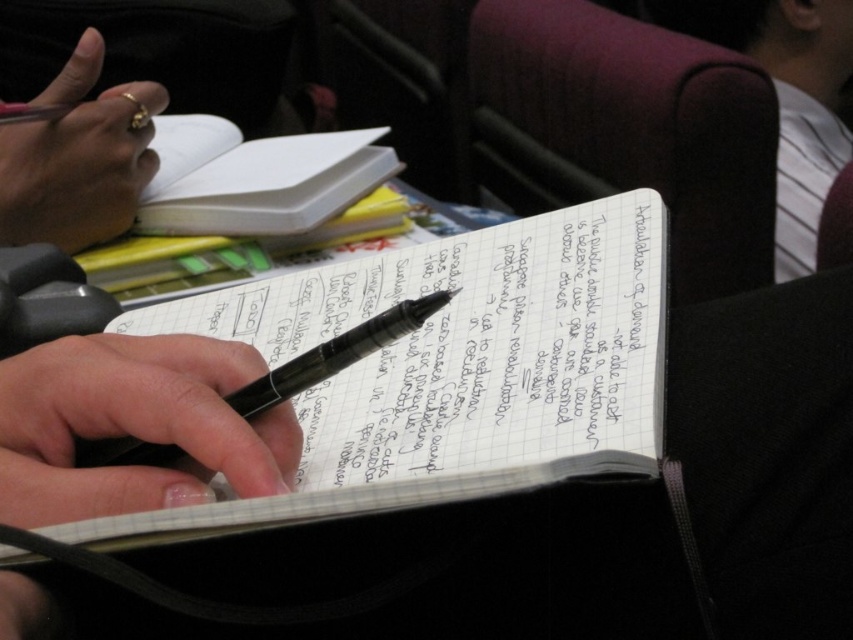
Question: Which of the following is the farthest from the observer?

Choices:
 (A) black matte pen at center
 (B) white lined notebook at center
 (C) white paper notebook at upper center

Answer: (C)

Question: Which point is farther to the camera?

Choices:
 (A) white lined notebook at center
 (B) black matte pen at center

Answer: (B)

Question: Is gold ring at upper left positioned before black glossy pen at center?

Choices:
 (A) yes
 (B) no

Answer: (B)

Question: Which of the following is the farthest from the observer?

Choices:
 (A) gold ring at upper left
 (B) black glossy pen at center

Answer: (A)

Question: Is white lined notebook at center closer to the viewer compared to gold ring at upper left?

Choices:
 (A) no
 (B) yes

Answer: (B)

Question: Is gold ring at upper left to the right of black glossy pen at center from the viewer's perspective?

Choices:
 (A) no
 (B) yes

Answer: (A)